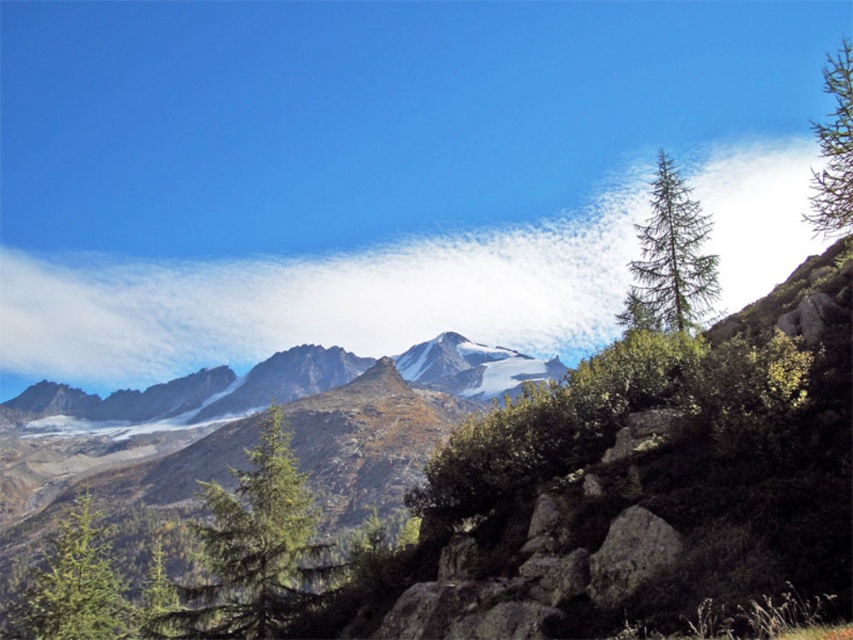
Between green needle-like tree at center-left and green needle-like tree at right, which one has more height?

With more height is green needle-like tree at right.

Locate an element on the screen. green needle-like tree at center-left is located at coordinates (253, 550).

The height and width of the screenshot is (640, 853). I want to click on green needle-like tree at center-left, so (x=253, y=550).

Which of these two, white fluffy cloud at upper center or green matte tree at lower left, stands taller?

Standing taller between the two is white fluffy cloud at upper center.

Between point (144, 320) and point (53, 554), which one is positioned behind?

The point (144, 320) is more distant.

You are a GUI agent. You are given a task and a screenshot of the screen. Output one action in this format:
    pyautogui.click(x=<x>, y=<y>)
    Task: Click on the white fluffy cloud at upper center
    The height and width of the screenshot is (640, 853).
    Given the screenshot: What is the action you would take?
    pyautogui.click(x=318, y=300)

Between green matte tree at lower left and green matte tree at upper right, which one is positioned lower?

green matte tree at lower left

Does point (47, 557) come in front of point (851, 120)?

No, (47, 557) is further to viewer.

At what (x,y) coordinates should I click in order to perform the action: click on green matte tree at lower left. Please return your answer as a coordinate pair (x, y). Image resolution: width=853 pixels, height=640 pixels. Looking at the image, I should click on (73, 588).